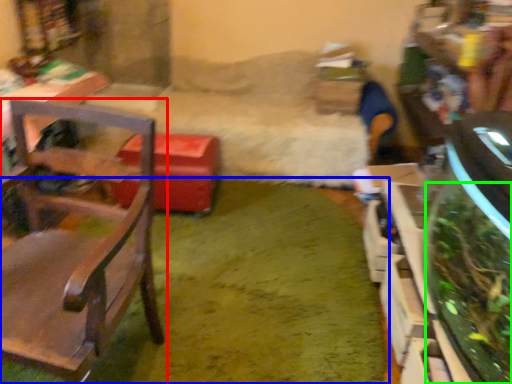
Question: Considering the real-world distances, which object is farthest from chair (highlighted by a red box)? grass (highlighted by a blue box) or plant (highlighted by a green box)?

Choices:
 (A) grass
 (B) plant

Answer: (B)